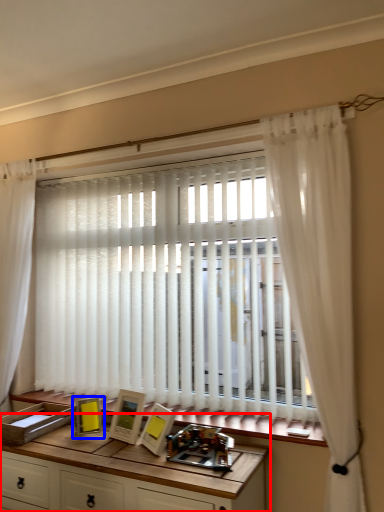
Question: Which of the following is the farthest to the observer, table (highlighted by a red box) or picture frame (highlighted by a blue box)?

Choices:
 (A) table
 (B) picture frame

Answer: (B)